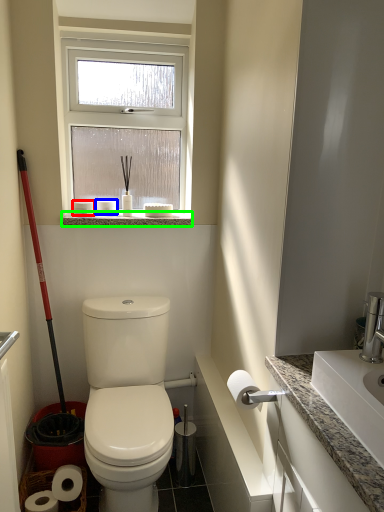
Question: Considering the real-world distances, which object is closest to toilet paper (highlighted by a red box)? toilet paper (highlighted by a blue box) or window sill (highlighted by a green box).

Choices:
 (A) toilet paper
 (B) window sill

Answer: (A)